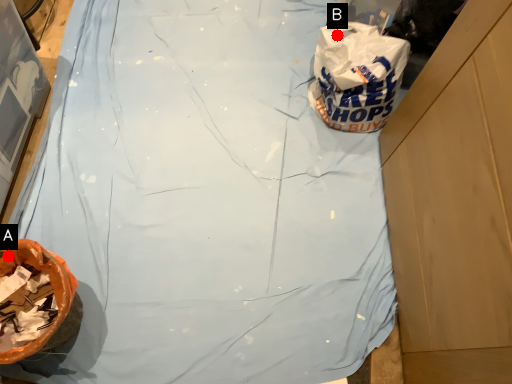
Question: Two points are circled on the image, labeled by A and B beside each circle. Which point is closer to the camera?

Choices:
 (A) A is closer
 (B) B is closer

Answer: (A)